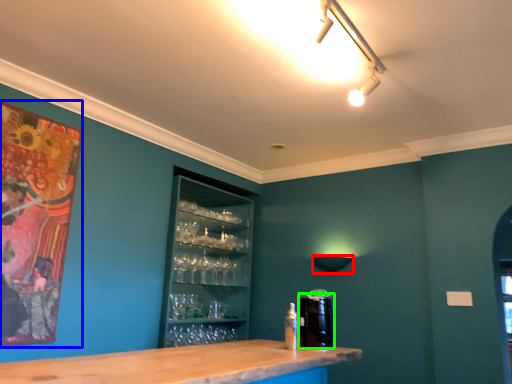
Question: Considering the real-world distances, which object is closest to lamp (highlighted by a red box)? picture frame (highlighted by a blue box) or beverage (highlighted by a green box).

Choices:
 (A) picture frame
 (B) beverage

Answer: (B)